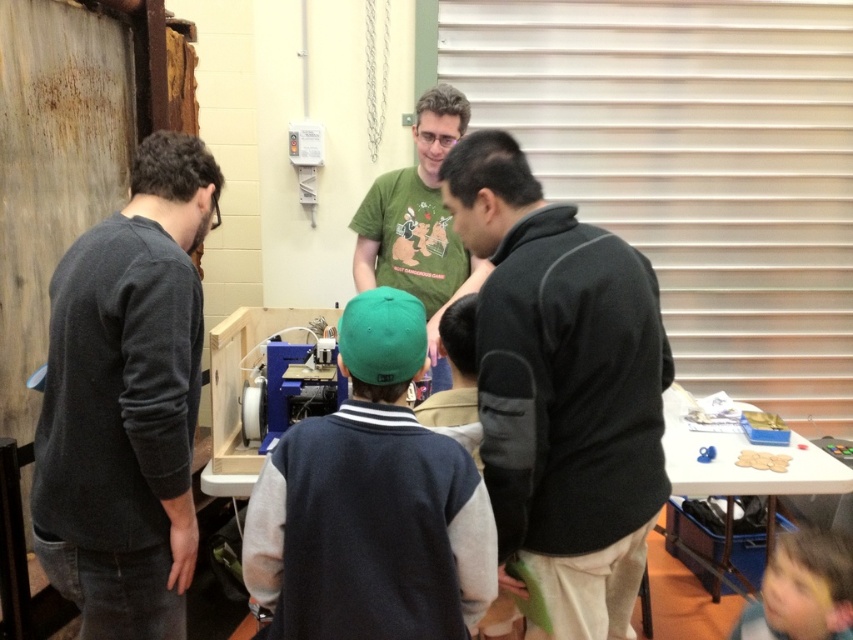
Question: Can you confirm if dark gray fleece jacket at center is thinner than white plastic table at lower right?

Choices:
 (A) yes
 (B) no

Answer: (A)

Question: Is green fabric cap at center above smooth brown hair at lower right?

Choices:
 (A) yes
 (B) no

Answer: (A)

Question: Considering the real-world distances, which object is closest to the white plastic table at lower right?

Choices:
 (A) green fabric cap at center
 (B) dark gray fleece jacket at center

Answer: (B)

Question: Which of the following is the farthest from the observer?

Choices:
 (A) green fabric cap at center
 (B) dark gray fleece jacket at center

Answer: (B)

Question: Which point is farther to the camera?

Choices:
 (A) smooth brown hair at lower right
 (B) green fabric cap at center
 (C) dark gray sweater at left

Answer: (A)

Question: Is dark gray fleece jacket at center to the left of white plastic table at lower right from the viewer's perspective?

Choices:
 (A) no
 (B) yes

Answer: (B)